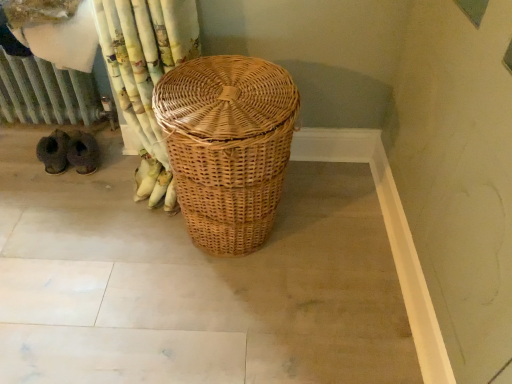
Question: Would you say metallic radiator at left is to the left or to the right of natural wicker basket at center in the picture?

Choices:
 (A) left
 (B) right

Answer: (A)

Question: Looking at their shapes, would you say metallic radiator at left is wider or thinner than natural wicker basket at center?

Choices:
 (A) thin
 (B) wide

Answer: (B)

Question: Is metallic radiator at left bigger or smaller than natural wicker basket at center?

Choices:
 (A) big
 (B) small

Answer: (B)

Question: From a real-world perspective, is natural wicker basket at center positioned above or below metallic radiator at left?

Choices:
 (A) above
 (B) below

Answer: (A)

Question: Is natural wicker basket at center wider or thinner than metallic radiator at left?

Choices:
 (A) wide
 (B) thin

Answer: (B)

Question: Relative to metallic radiator at left, is natural wicker basket at center in front or behind?

Choices:
 (A) front
 (B) behind

Answer: (A)

Question: Is natural wicker basket at center bigger or smaller than metallic radiator at left?

Choices:
 (A) big
 (B) small

Answer: (A)